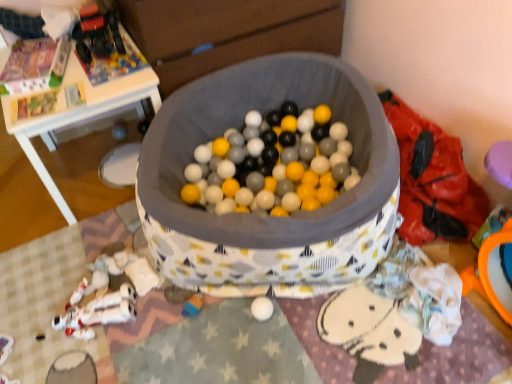
Where is `vacant area that lies between white matte plastic toy at lower left, placed as the second toy when sorted from top to bottom, and white plastic toy at lower left, the 2th toy ordered from the bottom`? vacant area that lies between white matte plastic toy at lower left, placed as the second toy when sorted from top to bottom, and white plastic toy at lower left, the 2th toy ordered from the bottom is located at coordinates point(100,283).